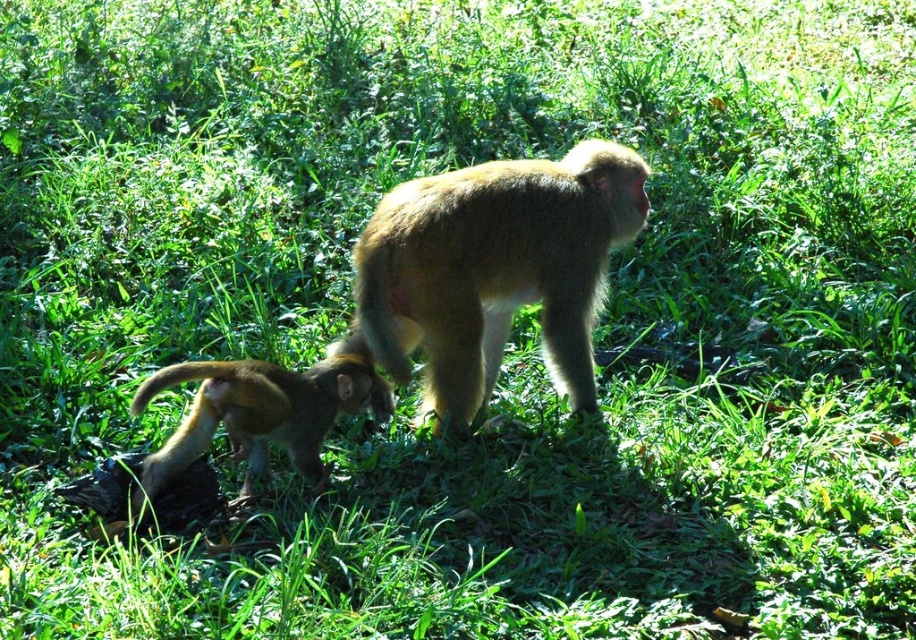
Question: Can you confirm if golden fur monkey at center is positioned above golden fur monkey at lower left?

Choices:
 (A) yes
 (B) no

Answer: (A)

Question: Which of the following is the closest to the observer?

Choices:
 (A) (606, 188)
 (B) (206, 428)

Answer: (B)

Question: Which point appears closest to the camera in this image?

Choices:
 (A) (437, 330)
 (B) (211, 380)

Answer: (B)

Question: Does golden fur monkey at center come behind golden fur monkey at lower left?

Choices:
 (A) no
 (B) yes

Answer: (B)

Question: Can you confirm if golden fur monkey at center is positioned to the left of golden fur monkey at lower left?

Choices:
 (A) yes
 (B) no

Answer: (B)